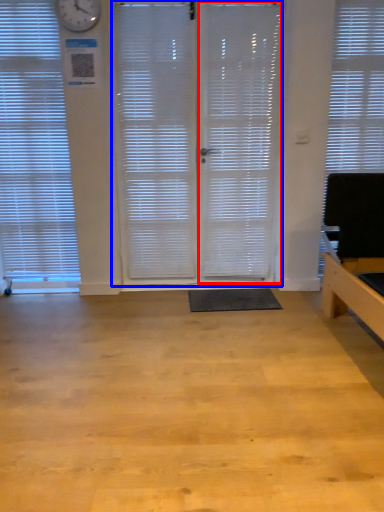
Question: Among these objects, which one is farthest to the camera, screen door (highlighted by a red box) or screen door (highlighted by a blue box)?

Choices:
 (A) screen door
 (B) screen door

Answer: (B)